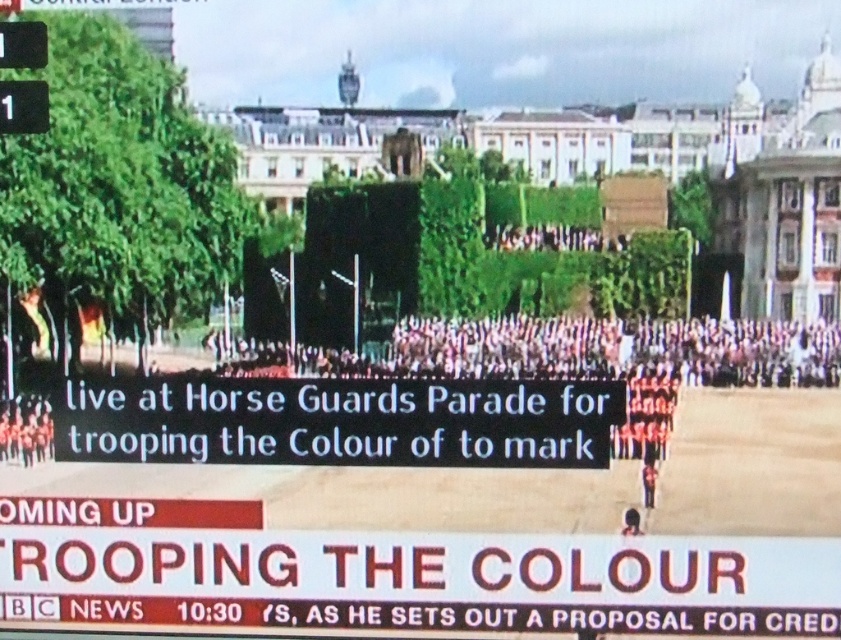
Question: Does black plastic sign at center lie in front of pink fabric crowd at center?

Choices:
 (A) no
 (B) yes

Answer: (B)

Question: Which object is closer to the camera taking this photo?

Choices:
 (A) black plastic sign at center
 (B) red uniform at center

Answer: (A)

Question: Is black plastic sign at center further to the viewer compared to pink fabric crowd at center?

Choices:
 (A) no
 (B) yes

Answer: (A)

Question: Which of the following is the closest to the observer?

Choices:
 (A) (664, 368)
 (B) (181, 396)
 (C) (652, 483)

Answer: (C)

Question: Observing the image, what is the correct spatial positioning of black plastic sign at center in reference to pink fabric crowd at center?

Choices:
 (A) right
 (B) left

Answer: (B)

Question: Which object appears closest to the camera in this image?

Choices:
 (A) red uniform at center
 (B) pink fabric crowd at center

Answer: (A)